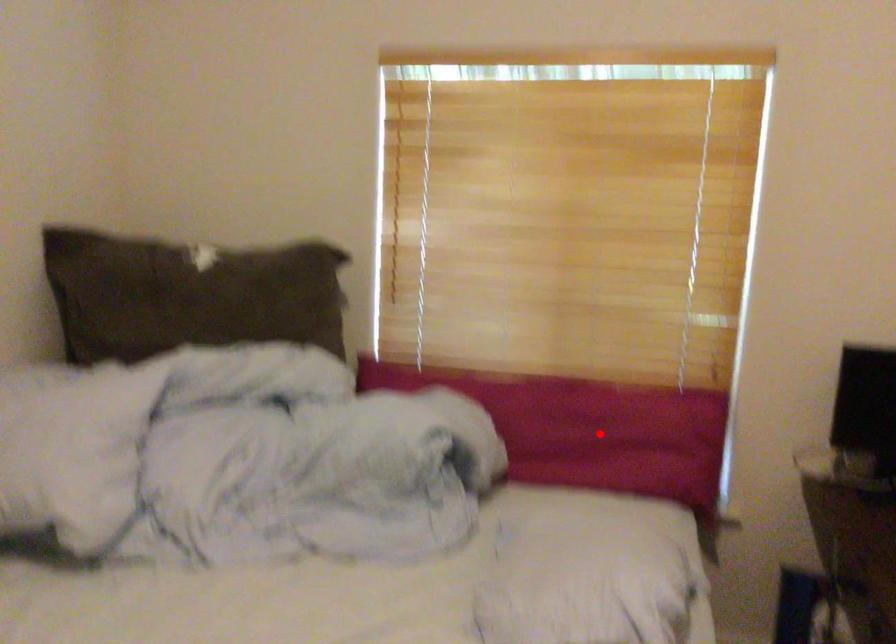
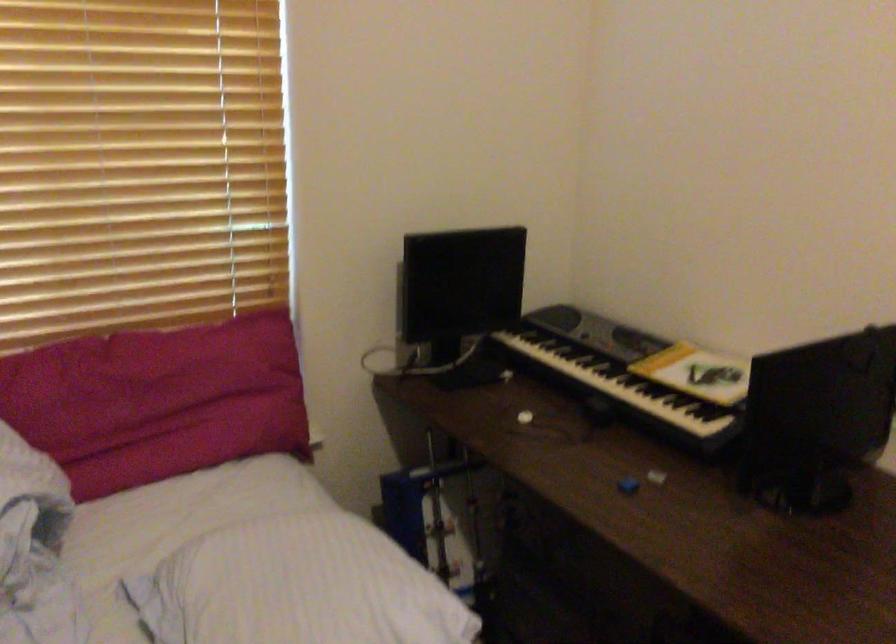
In the second image, find the point that corresponds to the highlighted location in the first image.

(159, 401)